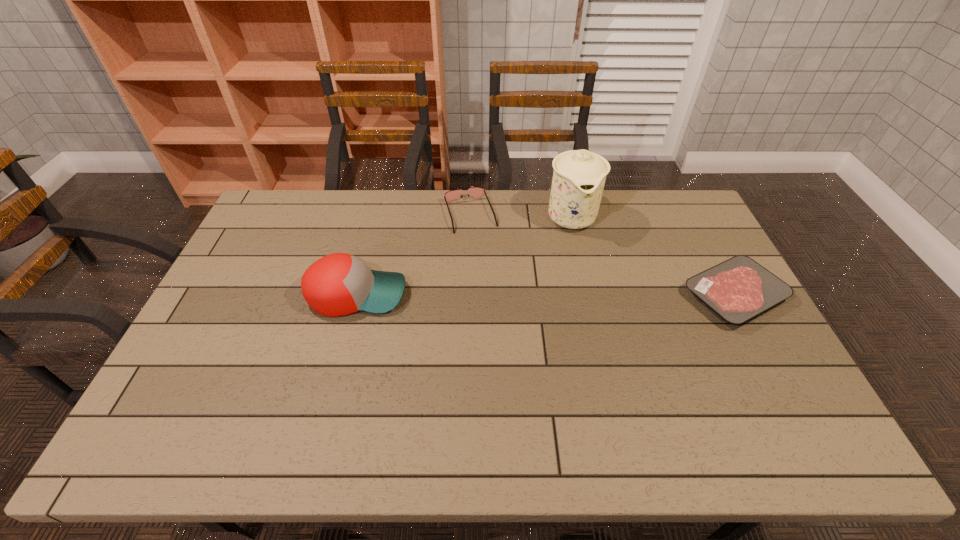
The image size is (960, 540). I want to click on the second tallest object, so click(338, 284).

Find the location of `baseball cap`. baseball cap is located at coordinates (338, 284).

Locate an element on the screen. The height and width of the screenshot is (540, 960). steak is located at coordinates pyautogui.click(x=738, y=289).

At what (x,y) coordinates should I click in order to perform the action: click on the shortest object. Please return your answer as a coordinate pair (x, y). The width and height of the screenshot is (960, 540). Looking at the image, I should click on (x=738, y=289).

You are a GUI agent. You are given a task and a screenshot of the screen. Output one action in this format:
    pyautogui.click(x=<x>, y=<y>)
    Task: Click on the second object from left to right
    
    Given the screenshot: What is the action you would take?
    pyautogui.click(x=476, y=192)

You are a GUI agent. You are given a task and a screenshot of the screen. Output one action in this format:
    pyautogui.click(x=<x>, y=<y>)
    Task: Click on the second shortest object
    The image size is (960, 540).
    Given the screenshot: What is the action you would take?
    pyautogui.click(x=476, y=192)

The width and height of the screenshot is (960, 540). What are the coordinates of `the tallest object` in the screenshot? It's located at (579, 176).

This screenshot has height=540, width=960. What are the coordinates of `the third object from left to right` in the screenshot? It's located at [579, 176].

Find the location of a particular element. blank area located 0.330m at the brim of the third shortest object is located at coordinates (516, 294).

Locate an element on the screen. The width and height of the screenshot is (960, 540). blank area located on the left of the steak is located at coordinates (627, 295).